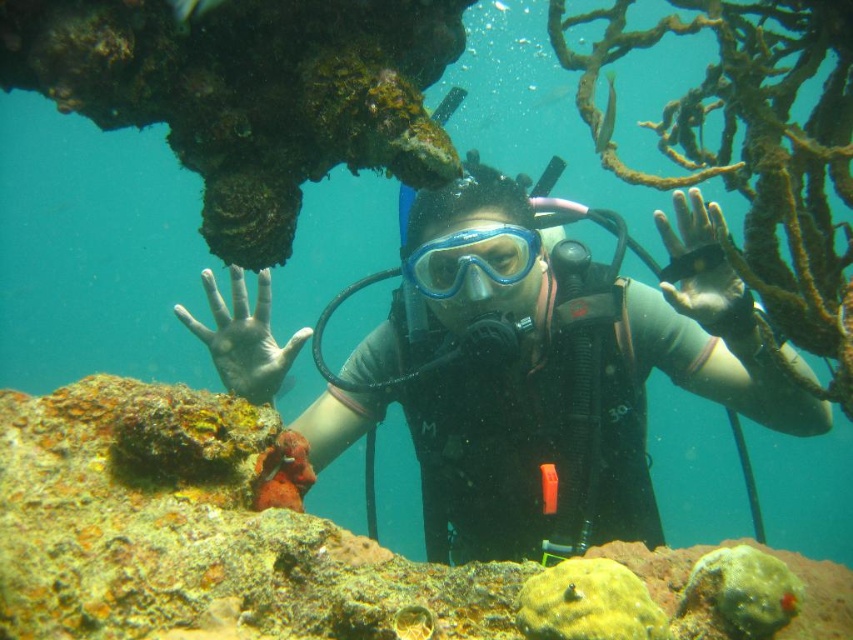
Who is positioned more to the right, yellow coral at center or blue matte/glass goggles at center?

From the viewer's perspective, blue matte/glass goggles at center appears more on the right side.

This screenshot has width=853, height=640. Identify the location of yellow coral at center. [195, 532].

You are a GUI agent. You are given a task and a screenshot of the screen. Output one action in this format:
    pyautogui.click(x=<x>, y=<y>)
    Task: Click on the yellow coral at center
    The width and height of the screenshot is (853, 640).
    Given the screenshot: What is the action you would take?
    (x=195, y=532)

Is point (428, 289) positioned in front of point (666, 230)?

No, it is behind (666, 230).

Is point (447, 292) farther from camera compared to point (709, 312)?

Yes, point (447, 292) is behind point (709, 312).

Is point (514, 232) less distant than point (709, 204)?

No, it is not.

This screenshot has width=853, height=640. Identify the location of blue matte/glass goggles at center. (473, 260).

Find the location of a particular element. matte rubber hand at center is located at coordinates (242, 337).

Which is more to the right, matte rubber hand at center or blue matte/glass goggles at center?

blue matte/glass goggles at center

Does point (216, 316) come closer to viewer compared to point (421, 276)?

Yes.

Find the location of `matte rubber hand at center`. matte rubber hand at center is located at coordinates (242, 337).